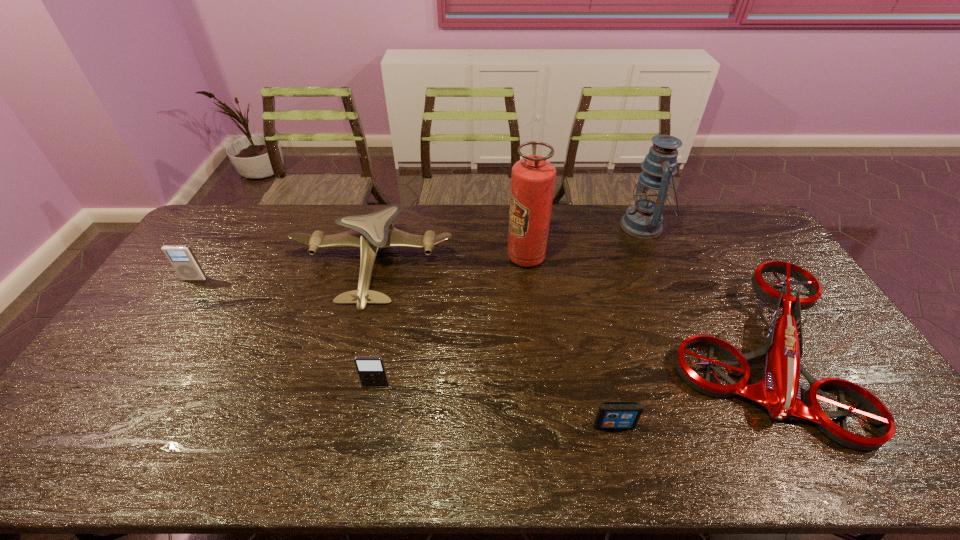
Find the location of a particular element. Image resolution: width=960 pixels, height=540 pixels. vacant space at the left edge is located at coordinates (225, 256).

In the image, there is a desktop. At what (x,y) coordinates should I click in order to perform the action: click on free region at the right edge. Please return your answer as a coordinate pair (x, y). The image size is (960, 540). Looking at the image, I should click on (763, 310).

Image resolution: width=960 pixels, height=540 pixels. Identify the location of free region at the near left corner of the desktop. (111, 448).

At what (x,y) coordinates should I click in order to perform the action: click on free spot between the right drone and the fire extinguisher. Please return your answer as a coordinate pair (x, y). The height and width of the screenshot is (540, 960). Looking at the image, I should click on (640, 305).

The width and height of the screenshot is (960, 540). Find the location of `free space that is in between the second farthest iPod and the leftmost object`. free space that is in between the second farthest iPod and the leftmost object is located at coordinates (285, 332).

The width and height of the screenshot is (960, 540). Identify the location of vacant space that is in between the second nearest iPod and the fire extinguisher. click(x=451, y=320).

Find the location of a particular element. vacant space in between the fire extinguisher and the shortest object is located at coordinates (570, 341).

The height and width of the screenshot is (540, 960). In order to click on free space between the fourth object from right to left and the shortest object in this screenshot , I will do `click(570, 341)`.

Find the location of a particular element. This screenshot has height=540, width=960. blank region between the second iPod from right to left and the leftmost iPod is located at coordinates (285, 332).

Locate an element on the screen. The image size is (960, 540). blank region between the second nearest iPod and the left drone is located at coordinates (374, 324).